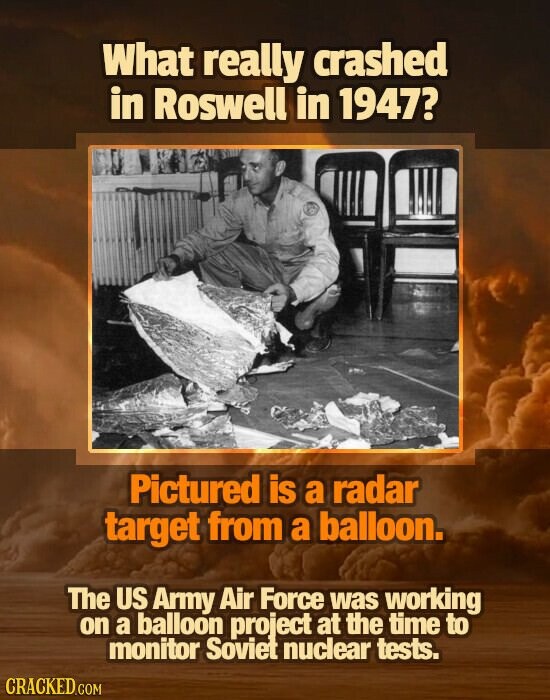
The image size is (550, 700). Find the location of `leftmost chair`. leftmost chair is located at coordinates (357, 232).